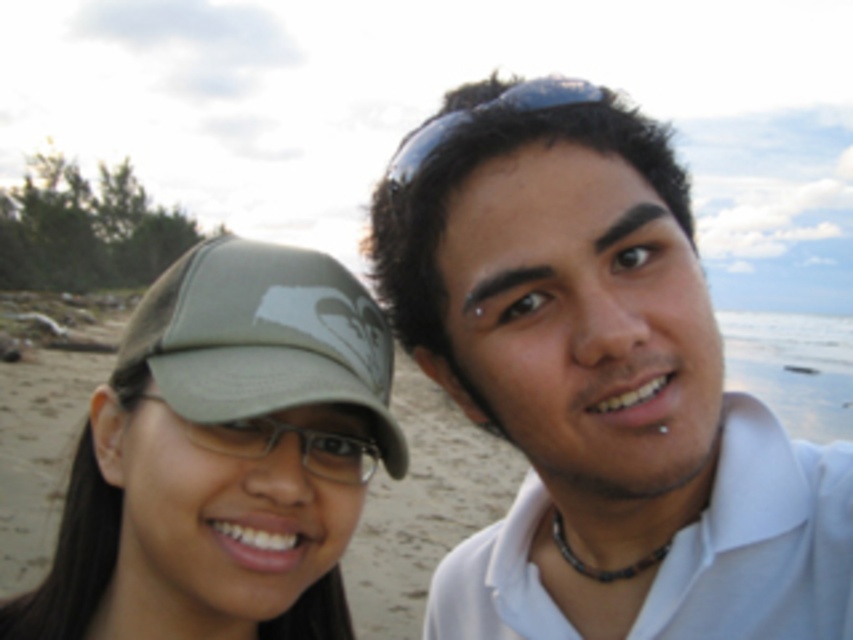
Question: Estimate the real-world distances between objects in this image. Which object is farther from the matte khaki baseball cap at lower left?

Choices:
 (A) matte khaki cap at left
 (B) white matte shirt at center
 (C) black rubber goggles at upper center

Answer: (B)

Question: Which of these objects is positioned closest to the matte khaki cap at left?

Choices:
 (A) white matte shirt at center
 (B) black rubber goggles at upper center

Answer: (A)

Question: Which of the following is the farthest from the observer?

Choices:
 (A) white matte shirt at center
 (B) black rubber goggles at upper center
 (C) matte khaki baseball cap at lower left

Answer: (B)

Question: Does white matte shirt at center have a lesser width compared to matte khaki baseball cap at lower left?

Choices:
 (A) yes
 (B) no

Answer: (B)

Question: Does matte khaki cap at left have a greater width compared to black rubber goggles at upper center?

Choices:
 (A) yes
 (B) no

Answer: (A)

Question: Does white matte shirt at center appear under matte khaki baseball cap at lower left?

Choices:
 (A) yes
 (B) no

Answer: (A)